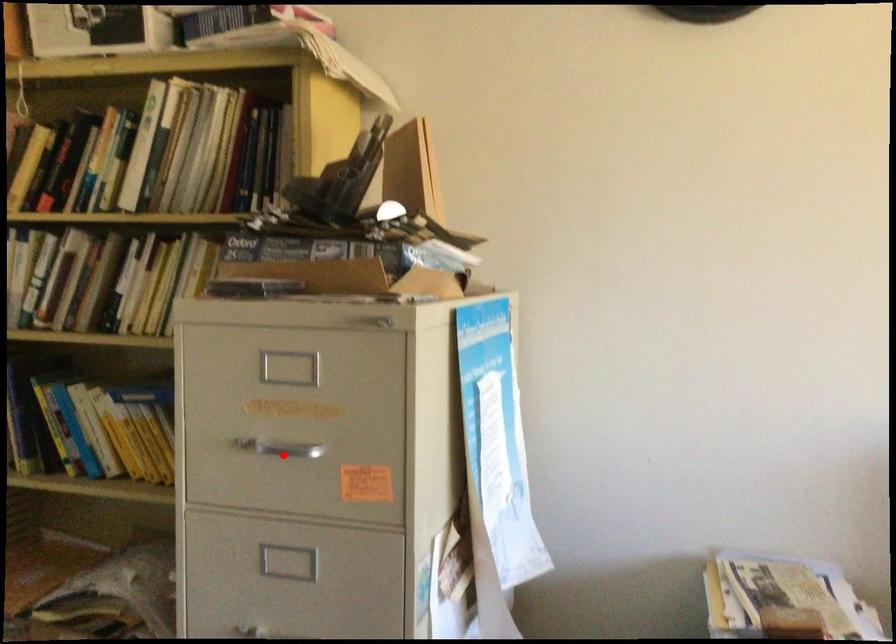
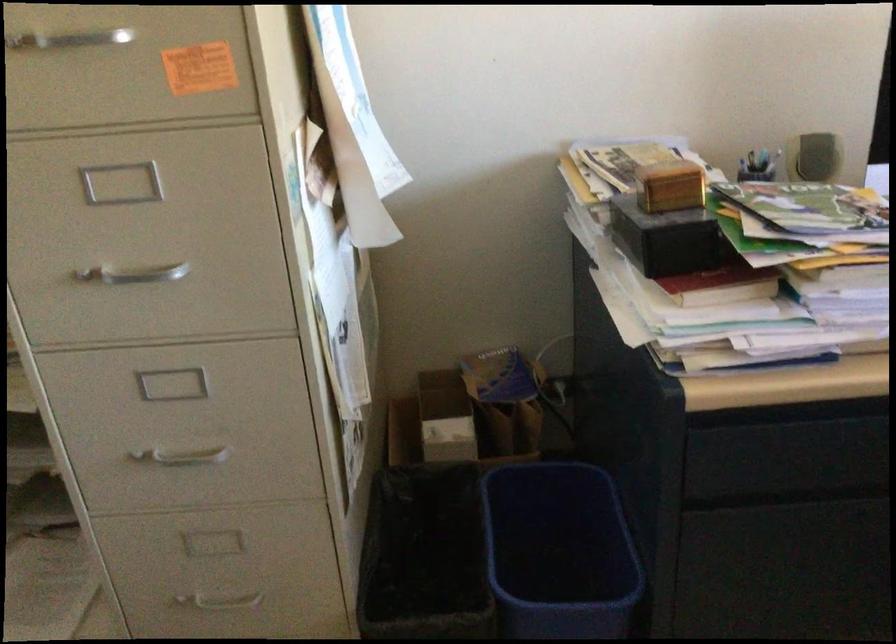
Question: I am providing you with two images of the same scene from different viewpoints. In image1, a red point is highlighted. Considering the same 3D point in image2, which of the following is correct?

Choices:
 (A) It is closer
 (B) It is farther

Answer: (A)